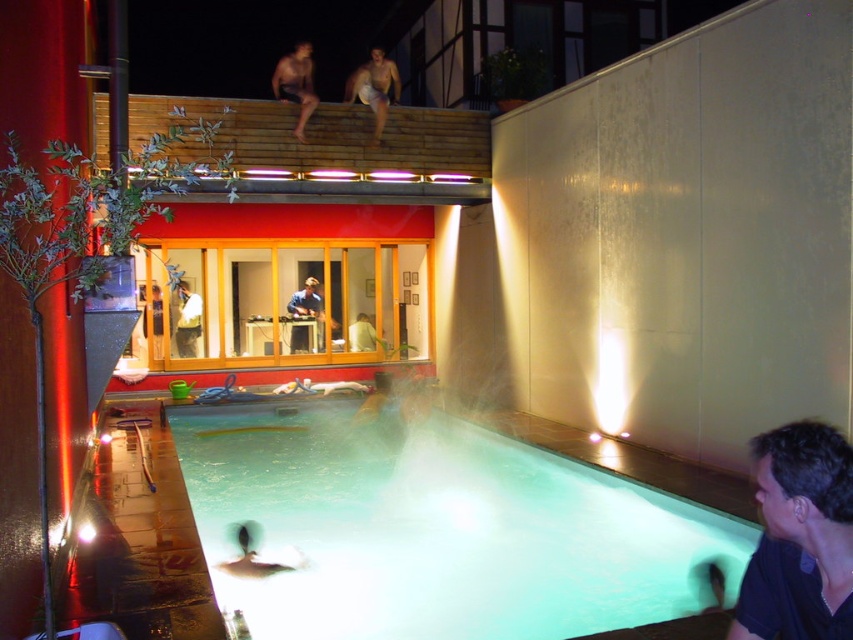
Question: Does clear acrylic pool at lower center have a smaller size compared to skinny man at upper center?

Choices:
 (A) no
 (B) yes

Answer: (B)

Question: Is dark blue shirt at lower right positioned behind blue fabric shirt at center?

Choices:
 (A) yes
 (B) no

Answer: (B)

Question: Considering the real-world distances, which object is farthest from the light brown wooden chair at center?

Choices:
 (A) yellow fabric shirt at center
 (B) skinny man at upper center
 (C) smooth skin man at upper center

Answer: (C)

Question: Which object appears farthest from the camera in this image?

Choices:
 (A) yellow fabric shirt at center
 (B) clear acrylic pool at lower center
 (C) skinny man at upper center

Answer: (A)

Question: Can you confirm if clear acrylic pool at lower center is positioned to the right of smooth wooden chair at center?

Choices:
 (A) no
 (B) yes

Answer: (B)

Question: Which is farther from the skinny man at upper center?

Choices:
 (A) light brown wooden chair at center
 (B) smooth wooden chair at center
 (C) clear acrylic pool at lower center

Answer: (C)